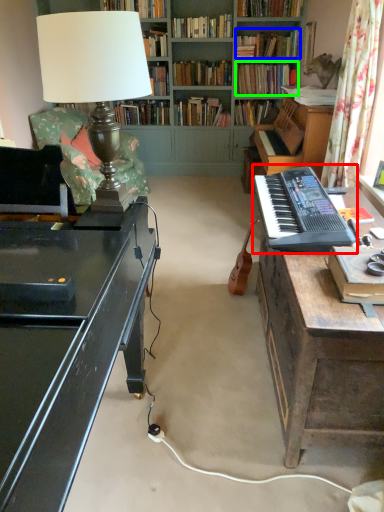
Question: Which object is the closest to the musical keyboard (highlighted by a red box)? Choose among these: book (highlighted by a blue box) or book (highlighted by a green box).

Choices:
 (A) book
 (B) book

Answer: (B)